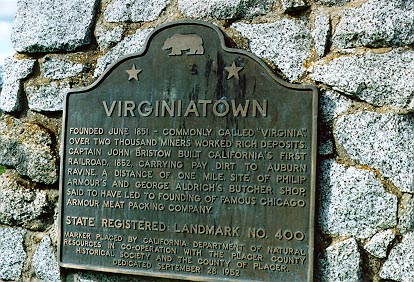
This screenshot has width=414, height=282. What are the coordinates of `plaque` in the screenshot? It's located at (x=158, y=67).